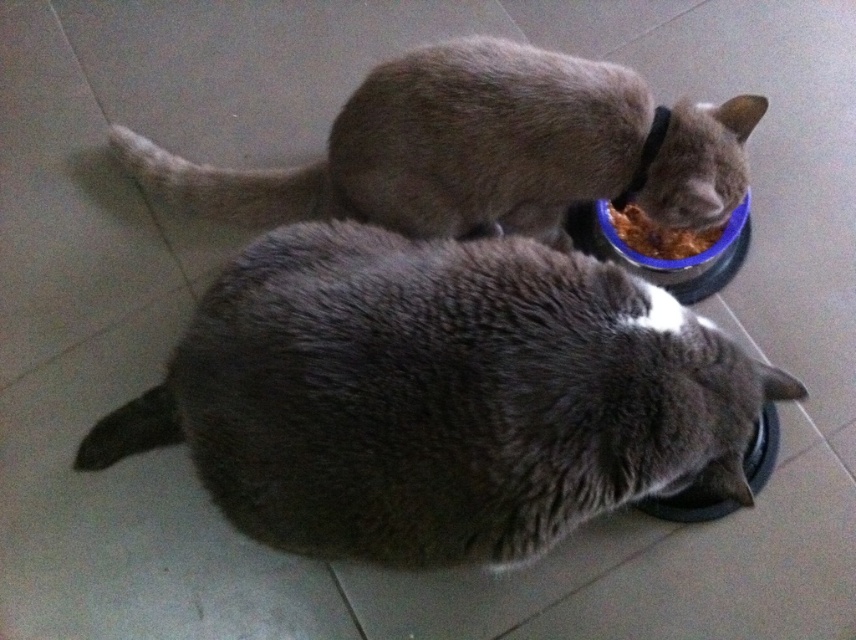
You are a photographer trying to capture a closeup of the blue plastic bowl at center while avoiding the gray fluffy cat at lower center. Based on their positions, can you tell if the cat is blocking the bowl from your view?

The gray fluffy cat at lower center is closer to the viewer than the blue plastic bowl at center, so the cat is blocking the bowl from your view.

You are standing in a room with two cats eating from separate bowls on the tiled floor. You see the point marked at coordinates (484,148). Which cat is located at that point? The cats are the fuzzy gray cat at upper center and the lighter brownish cat in the background.

The point at coordinates (484,148) corresponds to the fuzzy gray cat at upper center.